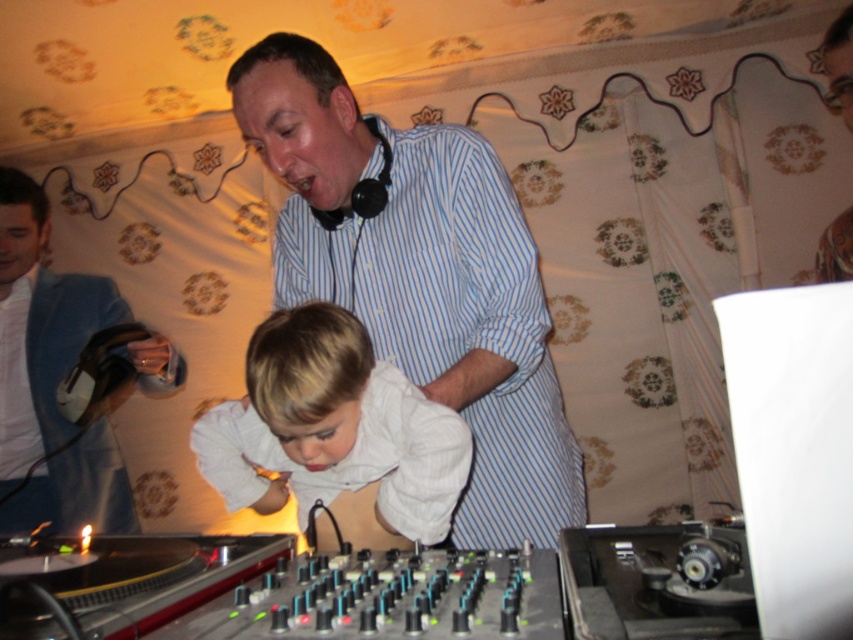
Question: From the image, what is the correct spatial relationship of blue striped shirt at center in relation to blue fabric jacket at left?

Choices:
 (A) above
 (B) below

Answer: (A)

Question: Considering the real-world distances, which object is farthest from the blue striped shirt at center?

Choices:
 (A) white shirt at center
 (B) blue fabric jacket at left

Answer: (B)

Question: Can you confirm if white shirt at center is smaller than blue fabric jacket at left?

Choices:
 (A) no
 (B) yes

Answer: (B)

Question: Which point is closer to the camera?

Choices:
 (A) 369,449
 (B) 322,227
 (C) 136,365

Answer: (A)

Question: Which point is closer to the camera?

Choices:
 (A) (19, 275)
 (B) (430, 304)

Answer: (B)

Question: Is white shirt at center further to the viewer compared to blue fabric jacket at left?

Choices:
 (A) no
 (B) yes

Answer: (A)